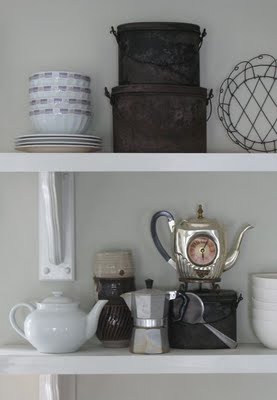
The width and height of the screenshot is (277, 400). Identify the location of stack of bowls. (x=269, y=306), (x=60, y=92).